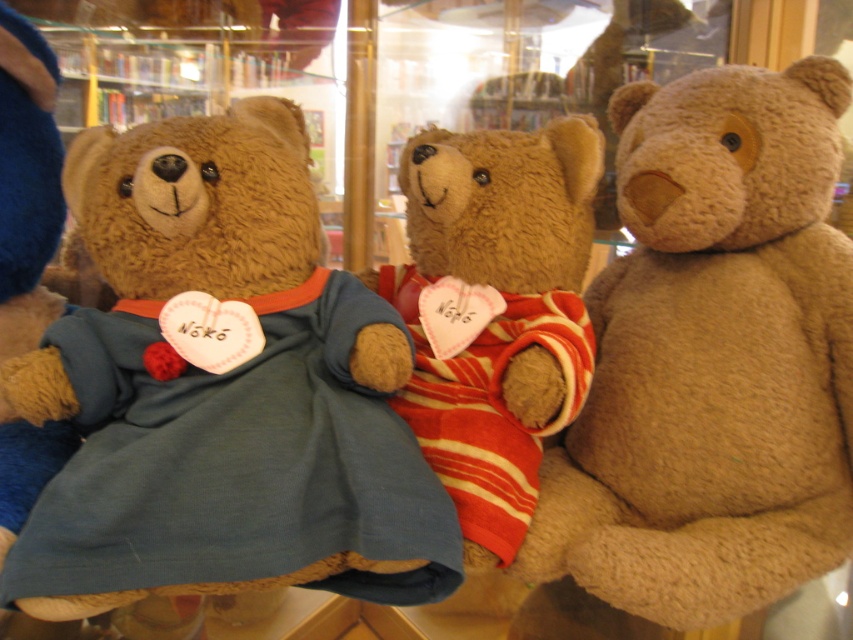
You are a customer in the store and want to place both the velvety brown teddy bear at center and the fuzzy brown teddy bear at right into a gift box that can only hold items up to 30 cm in width. Can you fit both teddy bears into the box if the total width of both teddy bears combined does not exceed the box limit?

The velvety brown teddy bear at center might be wider than fuzzy brown teddy bear at right, so their combined width could exceed the 30 cm limit. It is uncertain whether they will fit without knowing their exact widths.

You are holding a camera and want to take a photo of the fuzzy brown teddy bear at right. The camera requires a minimum distance of 70 centimeters to focus properly. Can you take a clear photo from your current position?

The fuzzy brown teddy bear at right and camera are 80.31 centimeters apart, which is more than the required 70 centimeters. Therefore, you can take a clear photo from your current position.